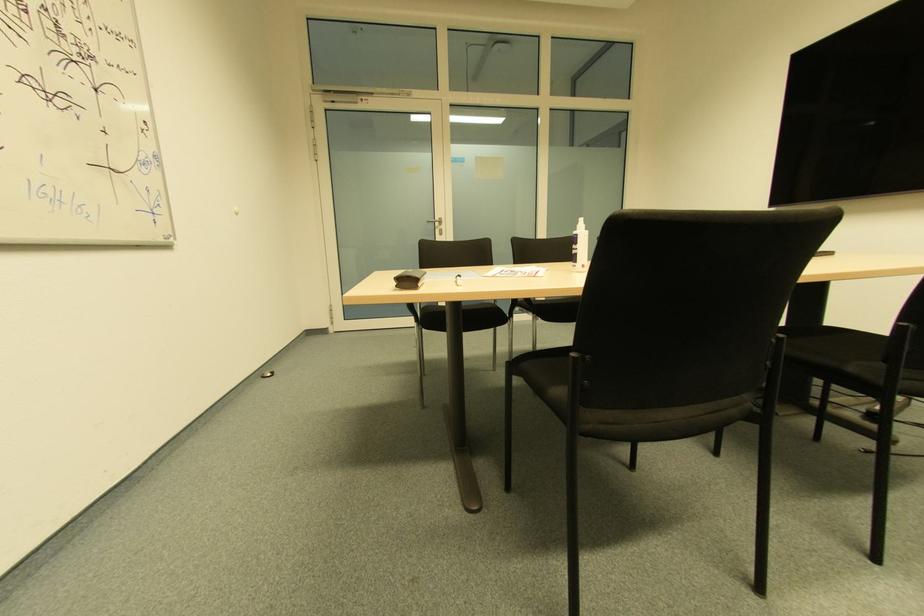
Identify the location of white marker. (458, 280).